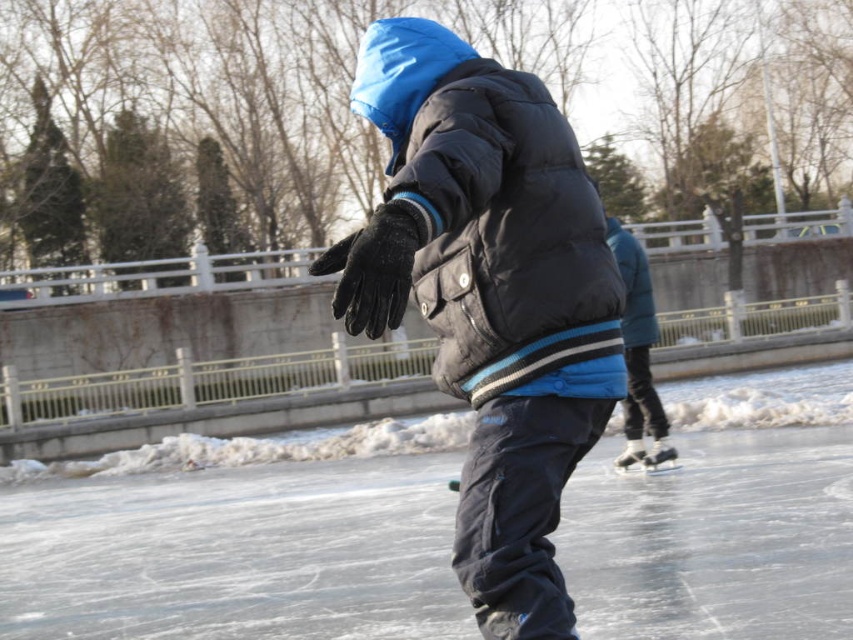
Is point (570, 349) farther from viewer compared to point (450, 301)?

No, it is in front of (450, 301).

Is matte black jacket at center shorter than black puffy jacket at center?

Incorrect, matte black jacket at center's height does not fall short of black puffy jacket at center's.

Does point (558, 385) lie in front of point (532, 250)?

Yes, it is.

You are a GUI agent. You are given a task and a screenshot of the screen. Output one action in this format:
    pyautogui.click(x=<x>, y=<y>)
    Task: Click on the matte black jacket at center
    This screenshot has width=853, height=640.
    Given the screenshot: What is the action you would take?
    pyautogui.click(x=489, y=296)